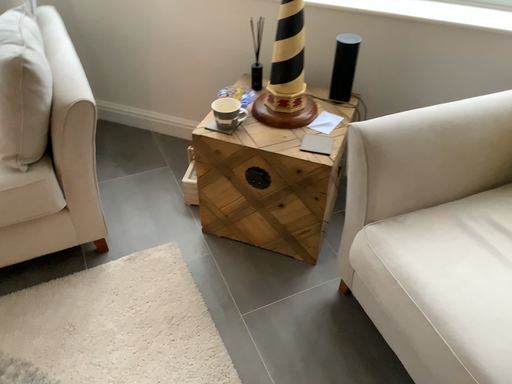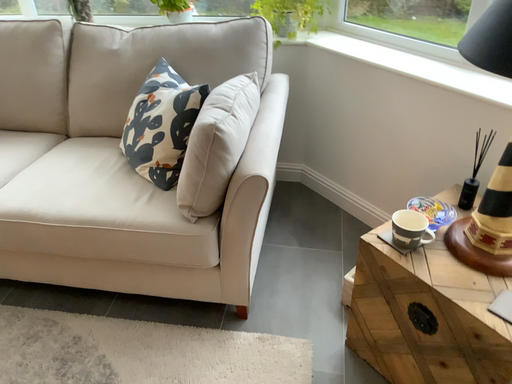
Question: How did the camera likely rotate when shooting the video?

Choices:
 (A) rotated left
 (B) rotated right

Answer: (A)